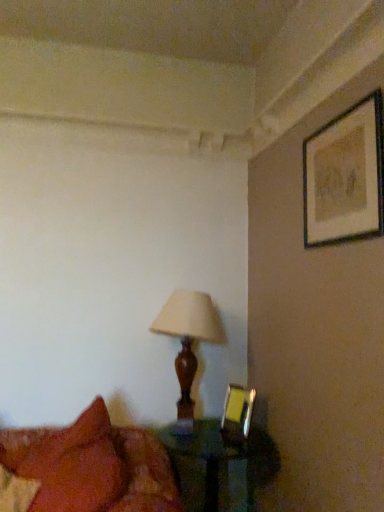
Question: From a real-world perspective, does translucent glass table at lower center stand above velvet red pillow at lower left?

Choices:
 (A) yes
 (B) no

Answer: (B)

Question: Is translucent glass table at lower center completely or partially outside of velvet red pillow at lower left?

Choices:
 (A) yes
 (B) no

Answer: (A)

Question: Is the position of translucent glass table at lower center less distant than that of velvet red pillow at lower left?

Choices:
 (A) yes
 (B) no

Answer: (B)

Question: Can you confirm if translucent glass table at lower center is positioned to the left of velvet red pillow at lower left?

Choices:
 (A) yes
 (B) no

Answer: (B)

Question: Does translucent glass table at lower center have a greater height compared to velvet red pillow at lower left?

Choices:
 (A) no
 (B) yes

Answer: (A)

Question: Considering the relative sizes of translucent glass table at lower center and velvet red pillow at lower left in the image provided, is translucent glass table at lower center thinner than velvet red pillow at lower left?

Choices:
 (A) yes
 (B) no

Answer: (A)

Question: From the image's perspective, is metallic gold picture frame at lower right, which ranks as the second picture frame in front-to-back order, located above translucent glass table at lower center?

Choices:
 (A) no
 (B) yes

Answer: (B)

Question: Could you tell me if metallic gold picture frame at lower right, marked as the 2th picture frame in a right-to-left arrangement, is facing translucent glass table at lower center?

Choices:
 (A) no
 (B) yes

Answer: (A)

Question: Is metallic gold picture frame at lower right, marked as the 2th picture frame in a right-to-left arrangement, wider than translucent glass table at lower center?

Choices:
 (A) yes
 (B) no

Answer: (B)

Question: Does metallic gold picture frame at lower right, the first picture frame positioned from the bottom, have a lesser width compared to translucent glass table at lower center?

Choices:
 (A) no
 (B) yes

Answer: (B)

Question: Is metallic gold picture frame at lower right, the second picture frame from the top, smaller than translucent glass table at lower center?

Choices:
 (A) no
 (B) yes

Answer: (B)

Question: Is translucent glass table at lower center at the back of metallic gold picture frame at lower right, placed as the first picture frame when sorted from left to right?

Choices:
 (A) no
 (B) yes

Answer: (A)

Question: Considering the relative positions of wooden lampshade at center and matte black picture frame at upper right, acting as the 2th picture frame starting from the left, in the image provided, is wooden lampshade at center behind matte black picture frame at upper right, acting as the 2th picture frame starting from the left,?

Choices:
 (A) yes
 (B) no

Answer: (A)